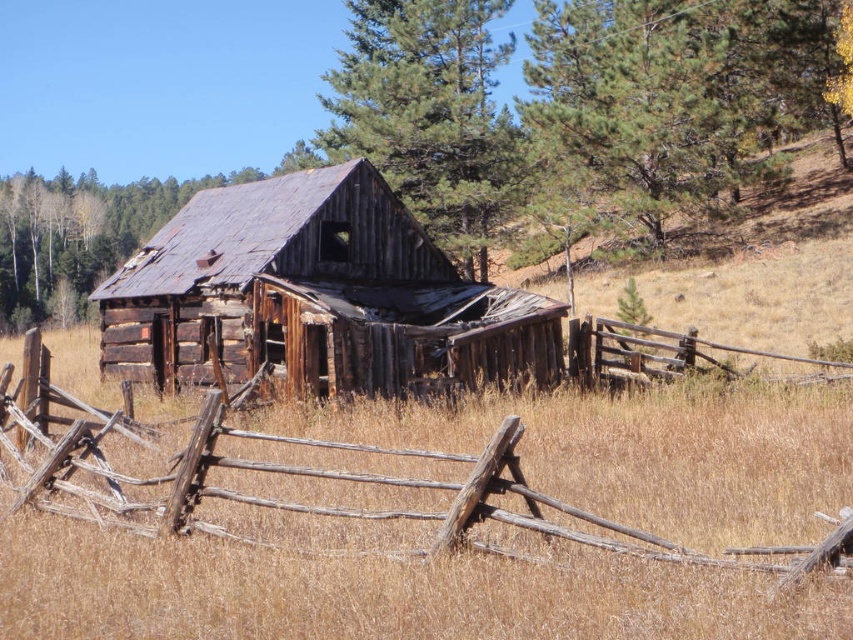
Question: Estimate the real-world distances between objects in this image. Which object is closer to the rusty wood barn at center?

Choices:
 (A) green rough bark tree at upper center
 (B) weathered wood fence at center

Answer: (B)

Question: Which point is farther to the camera?

Choices:
 (A) (711, 68)
 (B) (451, 138)
 (C) (119, 308)
 (D) (616, 541)

Answer: (B)

Question: Does rusty wood barn at center appear over green rough bark tree at upper center?

Choices:
 (A) yes
 (B) no

Answer: (B)

Question: Which point is farther from the camera taking this photo?

Choices:
 (A) (286, 378)
 (B) (833, 118)
 (C) (473, 51)

Answer: (B)

Question: Is green textured pine tree at upper center below weathered wood fence at center?

Choices:
 (A) no
 (B) yes

Answer: (A)

Question: Is rusty wood barn at center above green rough bark tree at upper center?

Choices:
 (A) no
 (B) yes

Answer: (A)